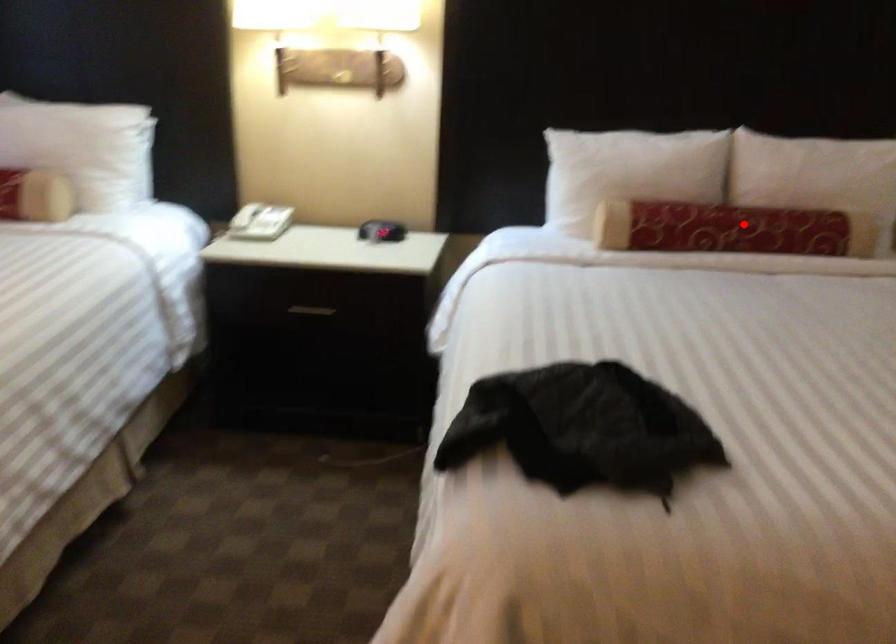
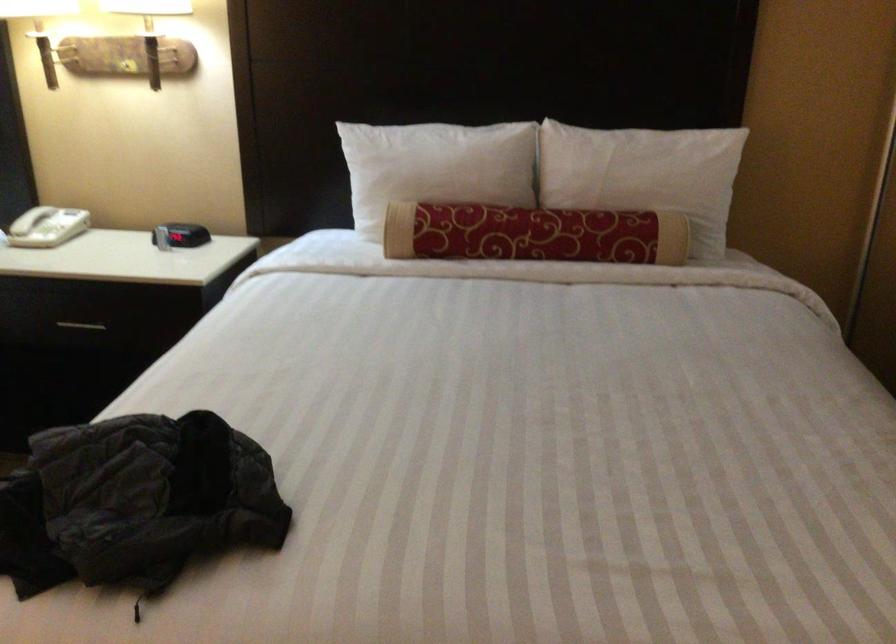
Find the pixel in the second image that matches the highlighted location in the first image.

(533, 234)